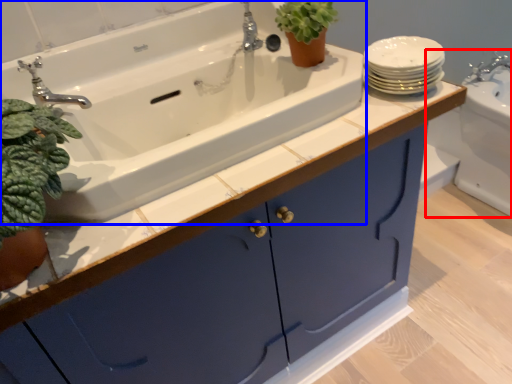
Question: Which object is closer to the camera taking this photo, sink (highlighted by a red box) or sink (highlighted by a blue box)?

Choices:
 (A) sink
 (B) sink

Answer: (B)